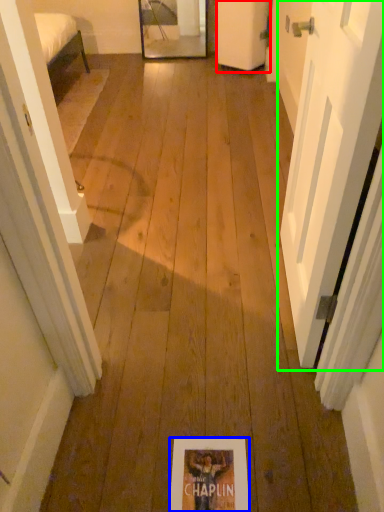
Question: Considering the real-world distances, which object is closest to door (highlighted by a red box)? flyer (highlighted by a blue box) or door (highlighted by a green box).

Choices:
 (A) flyer
 (B) door

Answer: (B)